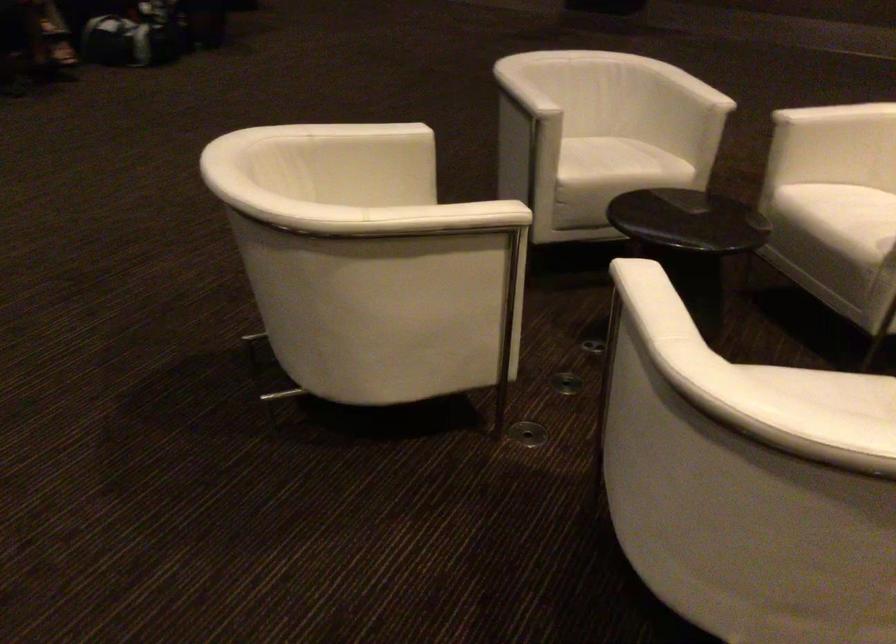
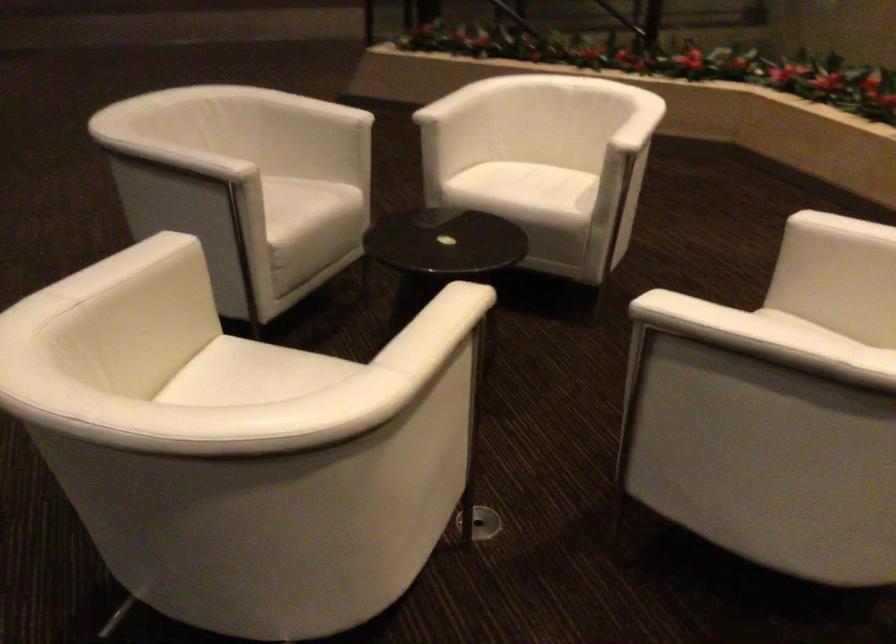
Find the pixel in the second image that matches (626,281) in the first image.

(694, 317)